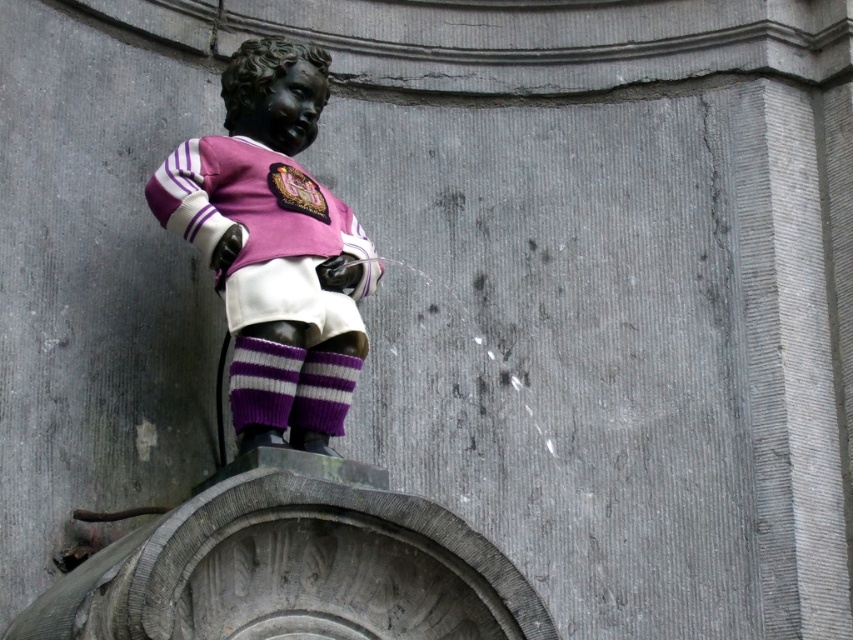
You are an art student observing the statue of a child in a sports uniform. You notice two bronze statues at the center. Which one is closer to you, the matte bronze statue at center or the polished bronze statue at center?

The matte bronze statue at center is closer to you because it is in front of the polished bronze statue at center.

You are an art curator examining two statues in the image. The first is the matte bronze statue at center and the second is the polished bronze statue at center. Which statue has a greater height?

The matte bronze statue at center is taller than the polished bronze statue at center.